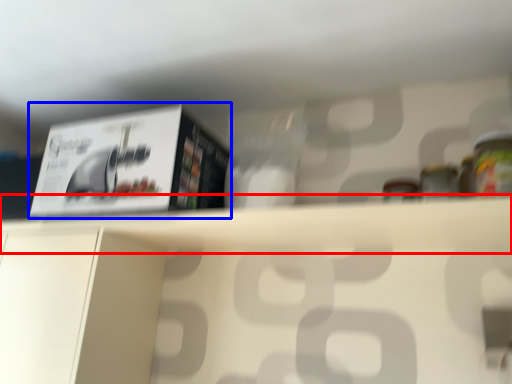
Question: Which point is closer to the camera, shelf (highlighted by a red box) or paperback book (highlighted by a blue box)?

Choices:
 (A) shelf
 (B) paperback book

Answer: (A)